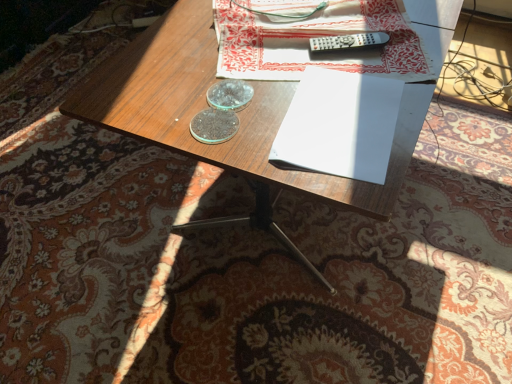
Identify the location of blank space above wooden desk at center (from a real-world perspective). The height and width of the screenshot is (384, 512). coord(291,53).